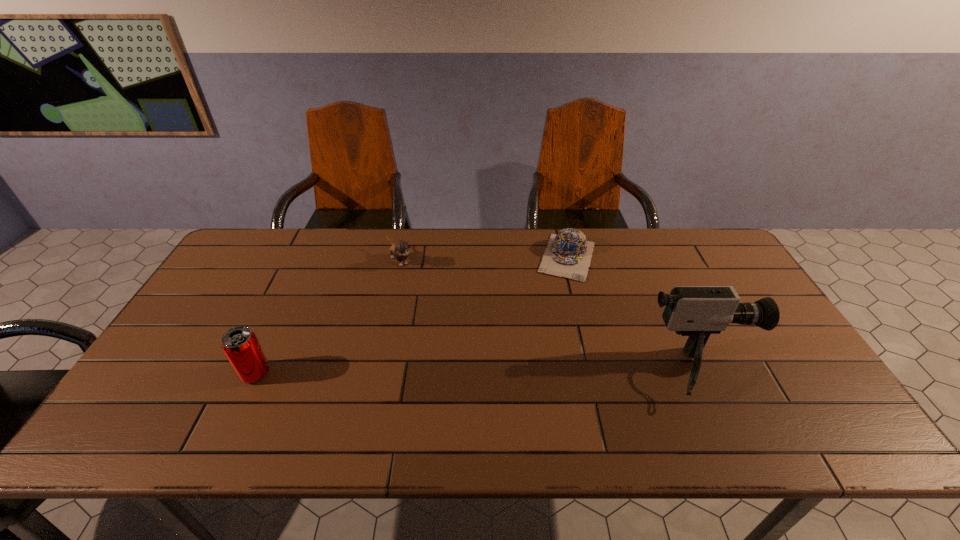
Locate an element on the screen. vacant spot on the desktop that is between the leftmost object and the camcorder and is positioned on the front-facing side of the kitten is located at coordinates (504, 373).

Image resolution: width=960 pixels, height=540 pixels. I want to click on free space on the desktop that is between the third shortest object and the rightmost object and is positioned on the front, side, and top of the third object from left to right, so click(532, 373).